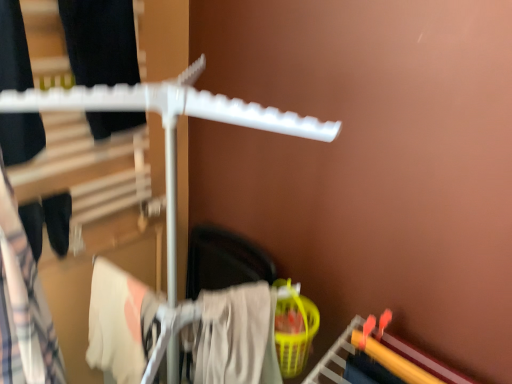
Question: Considering the positions of matte black pants at left, arranged as the 3th clothing when viewed from the right, and beige cotton towel at lower center, placed as the third clothing when sorted from left to right, in the image, is matte black pants at left, arranged as the 3th clothing when viewed from the right, wider or thinner than beige cotton towel at lower center, placed as the third clothing when sorted from left to right,?

Choices:
 (A) wide
 (B) thin

Answer: (B)

Question: Looking at the image, does matte black pants at left, arranged as the 3th clothing when viewed from the right, seem bigger or smaller compared to beige cotton towel at lower center, the 1th clothing viewed from the right?

Choices:
 (A) big
 (B) small

Answer: (B)

Question: Which is farther from the white cotton towel at lower left, arranged as the second clothing when viewed from the left?

Choices:
 (A) matte black pants at left, arranged as the 3th clothing when viewed from the right
 (B) beige cotton towel at lower center, placed as the third clothing when sorted from left to right

Answer: (A)

Question: Which object is positioned closest to the white cotton towel at lower left, which appears as the 2th clothing when viewed from the right?

Choices:
 (A) matte black pants at left, which ranks as the first clothing in left-to-right order
 (B) beige cotton towel at lower center, placed as the third clothing when sorted from left to right

Answer: (B)